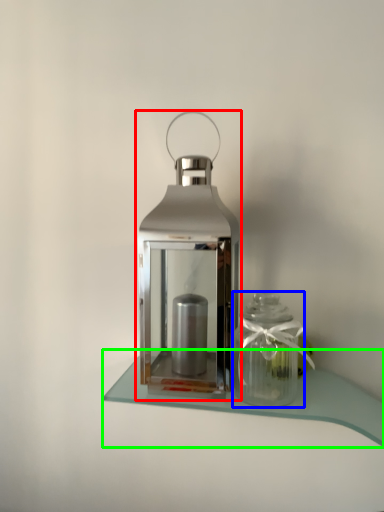
Question: Which object is the farthest from lantern (highlighted by a red box)? Choose among these: glass vase (highlighted by a blue box) or table (highlighted by a green box).

Choices:
 (A) glass vase
 (B) table

Answer: (B)